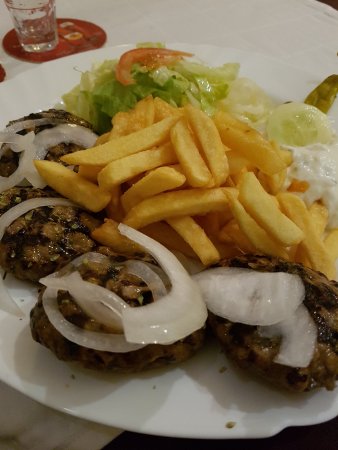
This screenshot has width=338, height=450. I want to click on cup, so click(x=23, y=21).